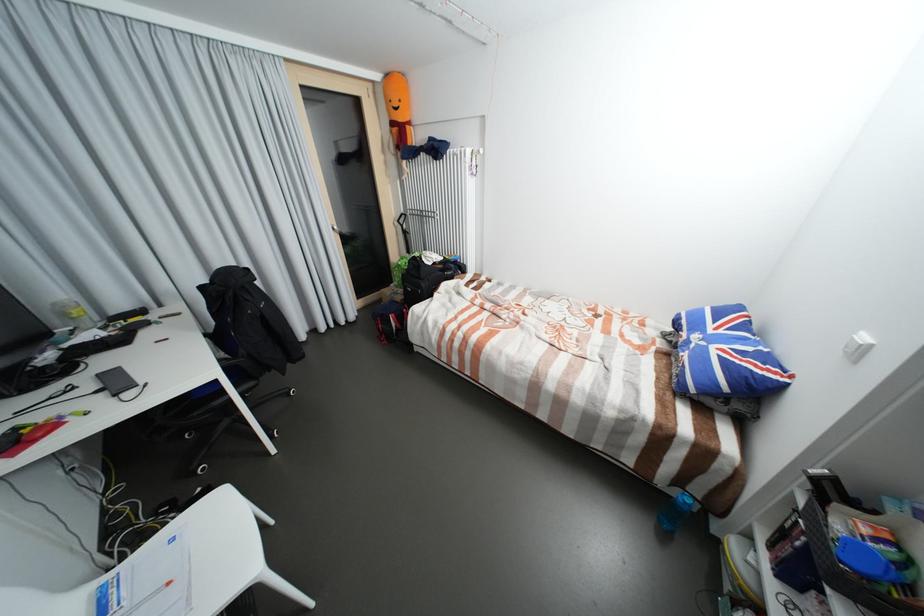
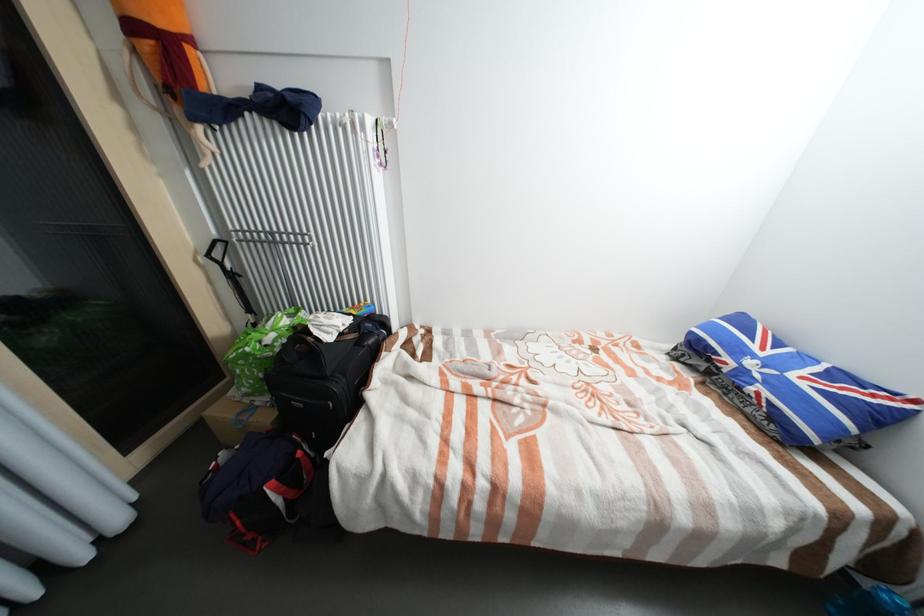
Locate, in the second image, the point that corresponds to the point at 441,264 in the first image.

(348, 334)